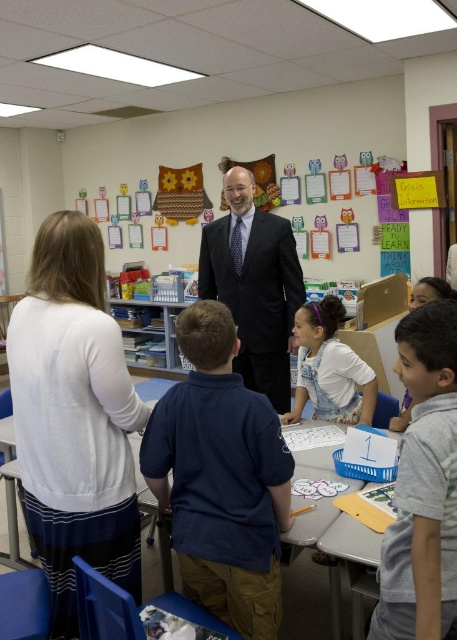
You are a student in the classroom and need to hand in your assignment to the teacher. The teacher is wearing either the dark blue shirt at center or the gray cotton shirt at lower right. Which one should you approach?

You should approach the dark blue shirt at center because it is positioned to the left of the gray cotton shirt at lower right, which is typically where teachers stand in a classroom setting.

You are a student in the classroom and want to see the teacher standing at center. Is the white cotton shirt at center blocking your view of the black suit at center?

The white cotton shirt at center is behind the black suit at center, so it is not blocking the view of the black suit at center.

You are a photographer trying to capture a candid shot of the black suit at center and the white cotton shirt at center. Since you want to ensure both subjects are in focus, you need to adjust your camera settings based on their sizes. Which subject requires a wider aperture to account for its size?

The black suit at center requires a wider aperture because its width is larger than the white cotton shirt at center, necessitating a greater depth of field adjustment to keep it in focus.